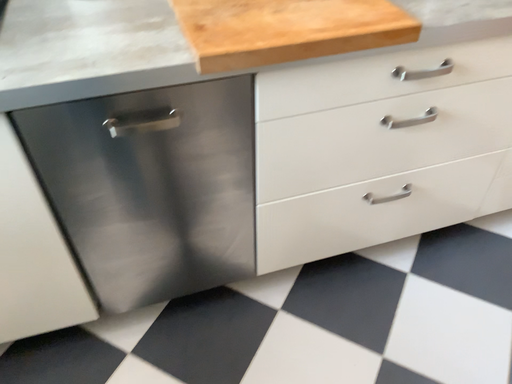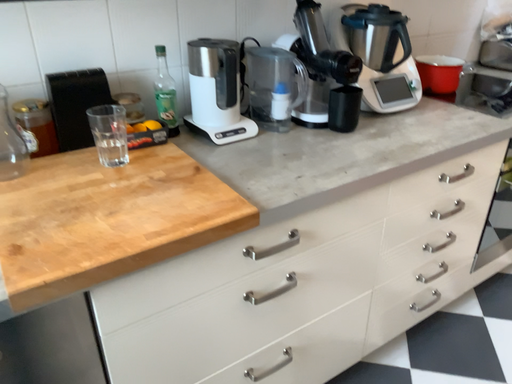
Question: How did the camera likely rotate when shooting the video?

Choices:
 (A) rotated left
 (B) rotated right

Answer: (B)